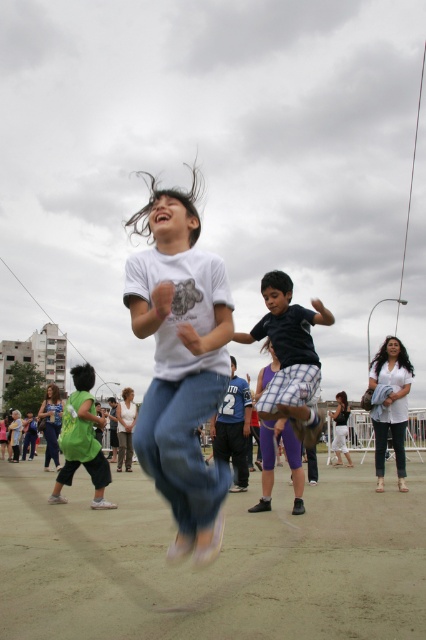
Question: Based on their relative distances, which object is farther from the black cotton shirt at center?

Choices:
 (A) green fabric shirt at lower left
 (B) white cotton t-shirt at center

Answer: (A)

Question: Which point is closer to the camera taking this photo?

Choices:
 (A) (78, 374)
 (B) (397, 467)
 (C) (279, 278)
 (D) (166, 326)

Answer: (D)

Question: Which of the following is the farthest from the observer?

Choices:
 (A) green fabric shirt at lower left
 (B) white cotton t-shirt at center
 (C) black cotton shirt at center
 (D) white cotton shirt at lower right

Answer: (D)

Question: Can you confirm if black cotton shirt at center is positioned above green fabric shirt at lower left?

Choices:
 (A) yes
 (B) no

Answer: (A)

Question: Can you confirm if black cotton shirt at center is positioned to the right of green fabric shirt at lower left?

Choices:
 (A) no
 (B) yes

Answer: (B)

Question: From the image, what is the correct spatial relationship of white cotton t-shirt at center in relation to white cotton shirt at lower right?

Choices:
 (A) below
 (B) above

Answer: (B)